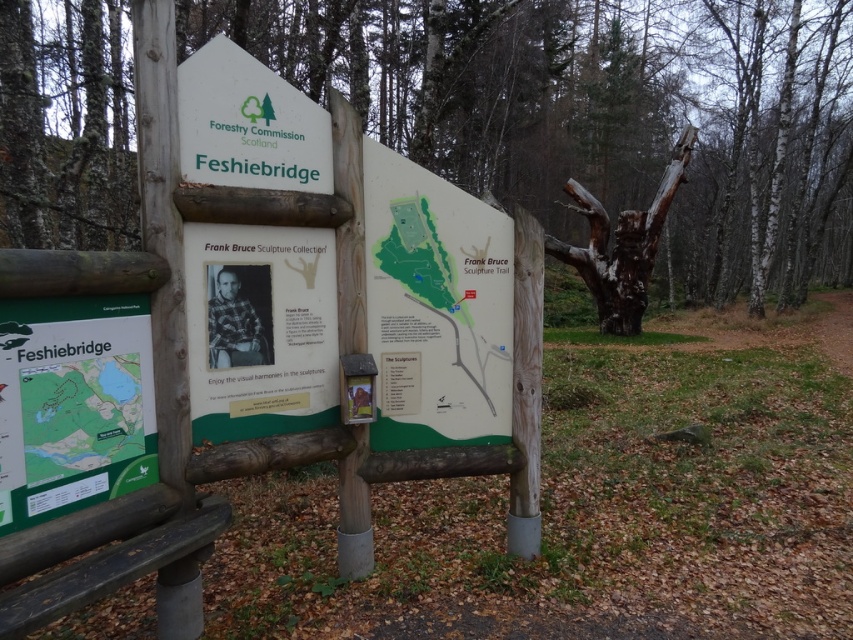
What is the relationship between the height of the white plastic sign at upper center and the dark gray wood bench at lower left?

The white plastic sign at upper center is much taller than the dark gray wood bench at lower left.

You are a park ranger who needs to place a new information board that is 1.5 meters wide. The board must be placed where it can be seen from the dark gray wood bench at lower left. Can the white plastic sign at upper center accommodate this new board in terms of size and visibility?

The white plastic sign at upper center is bigger than the dark gray wood bench at lower left. Since the new information board is 1.5 meters wide, and the existing white plastic sign at upper center is larger, it can likely accommodate the new board in terms of size. Additionally, being positioned at the upper center, it should be visible from the dark gray wood bench at lower left.